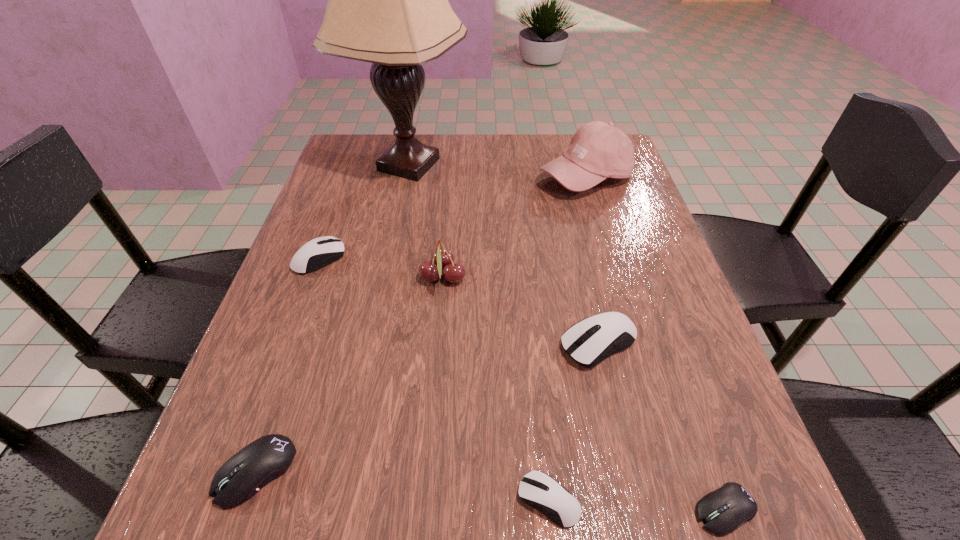
Choose which white mouse is the second nearest neighbor to the left black computer equipment. Please provide its 2D coordinates. Your answer should be formatted as a tuple, i.e. [(x, y)], where the tuple contains the x and y coordinates of a point satisfying the conditions above.

[(319, 252)]

Locate an element on the screen. white mouse that can be found as the second closest to the red cherry is located at coordinates (588, 342).

Where is `vacant space that satisfies the following two spatial constraints: 1. on the leaves of the sixth shortest object; 2. on the left side of the nearest white mouse`? This screenshot has width=960, height=540. vacant space that satisfies the following two spatial constraints: 1. on the leaves of the sixth shortest object; 2. on the left side of the nearest white mouse is located at coordinates (425, 500).

You are a GUI agent. You are given a task and a screenshot of the screen. Output one action in this format:
    pyautogui.click(x=<x>, y=<y>)
    Task: Click on the vacant space that satisfies the following two spatial constraints: 1. on the leaves of the red cherry; 2. on the front side of the left black computer equipment
    The width and height of the screenshot is (960, 540).
    Given the screenshot: What is the action you would take?
    pyautogui.click(x=427, y=471)

Locate an element on the screen. This screenshot has width=960, height=540. free space that satisfies the following two spatial constraints: 1. on the back side of the right black computer equipment; 2. on the leaves of the red cherry is located at coordinates (642, 277).

The image size is (960, 540). In order to click on free region that satisfies the following two spatial constraints: 1. on the leaves of the cherry; 2. on the left side of the smaller black computer equipment in this screenshot , I will do `click(424, 510)`.

The width and height of the screenshot is (960, 540). What are the coordinates of `free space that satisfies the following two spatial constraints: 1. on the leaves of the third tallest object; 2. on the left side of the smallest white mouse` in the screenshot? It's located at (x=425, y=500).

Locate an element on the screen. The image size is (960, 540). vacant space that satisfies the following two spatial constraints: 1. on the front side of the bigger black computer equipment; 2. on the right side of the second smallest white mouse is located at coordinates (242, 471).

Locate an element on the screen. This screenshot has width=960, height=540. vacant region that satisfies the following two spatial constraints: 1. on the back side of the rightmost computer equipment; 2. on the leaves of the cherry is located at coordinates (642, 277).